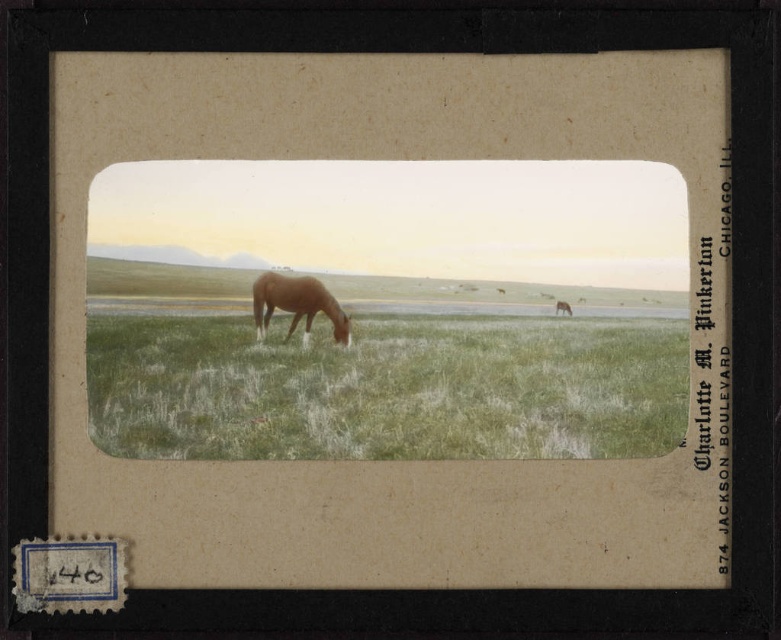
Who is shorter, green grassy field at center or light brown horse at center?

light brown horse at center

Who is positioned more to the right, green grassy field at center or light brown horse at center?

From the viewer's perspective, green grassy field at center appears more on the right side.

Is point (516, 380) closer to camera compared to point (293, 284)?

That is True.

Where is `green grassy field at center`? The height and width of the screenshot is (640, 781). green grassy field at center is located at coordinates (387, 387).

Does light brown horse at center have a smaller size compared to brown matte horse at center?

Actually, light brown horse at center might be larger than brown matte horse at center.

Is point (344, 323) behind point (571, 314)?

That is True.

What do you see at coordinates (296, 305) in the screenshot? I see `light brown horse at center` at bounding box center [296, 305].

You are a GUI agent. You are given a task and a screenshot of the screen. Output one action in this format:
    pyautogui.click(x=<x>, y=<y>)
    Task: Click on the light brown horse at center
    The height and width of the screenshot is (640, 781).
    Given the screenshot: What is the action you would take?
    pyautogui.click(x=296, y=305)

I want to click on green grassy field at center, so click(x=387, y=387).

Which is more to the right, green grassy field at center or brown matte horse at center?

brown matte horse at center

Locate an element on the screen. green grassy field at center is located at coordinates (387, 387).